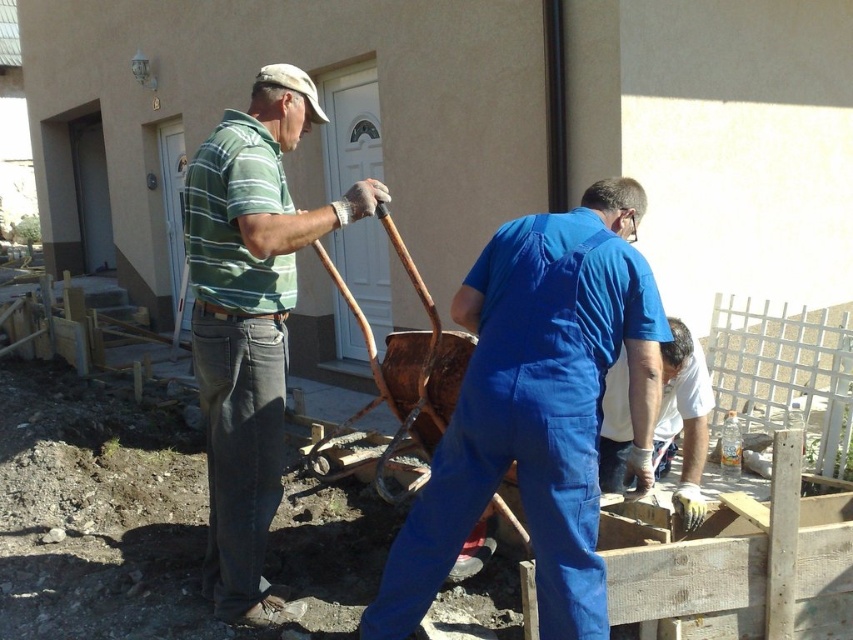
Question: Which point is farther from the camera taking this photo?

Choices:
 (A) (584, 547)
 (B) (660, 432)

Answer: (B)

Question: From the image, what is the correct spatial relationship of green striped shirt at center in relation to white matte gloves at lower right?

Choices:
 (A) left
 (B) right

Answer: (A)

Question: Is green striped shirt at center to the right of white matte gloves at lower right from the viewer's perspective?

Choices:
 (A) no
 (B) yes

Answer: (A)

Question: Is green striped shirt at center positioned behind white matte gloves at lower right?

Choices:
 (A) yes
 (B) no

Answer: (B)

Question: Based on their relative distances, which object is nearer to the white matte gloves at lower right?

Choices:
 (A) blue coveralls at center
 (B) green striped shirt at center

Answer: (A)

Question: Which point is farther to the camera?

Choices:
 (A) (247, 289)
 (B) (437, 589)
 (C) (672, 355)

Answer: (C)